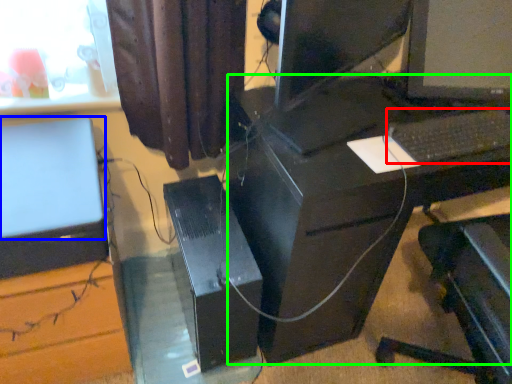
Question: Which is nearer to the computer keyboard (highlighted by a red box)? computer monitor (highlighted by a blue box) or computer desk (highlighted by a green box).

Choices:
 (A) computer monitor
 (B) computer desk

Answer: (B)